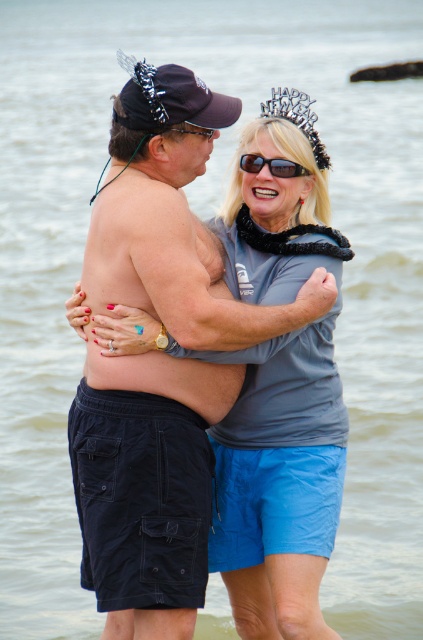
You are a photographer trying to capture a candid shot of the two people in the scene. You want to ensure both the sunglasses at center and the matte black goggles at center are clearly visible in the frame. Given their current distance apart, is there a risk that one might be out of focus if you focus on the other?

The sunglasses at center and matte black goggles at center are 4.96 feet apart. If you focus on one, the other may be slightly out of focus due to the distance, depending on your camera settings. Adjust your aperture for a deeper depth of field to ensure both are sharp.

You are a photographer trying to capture a clear shot of the sunglasses at center and the matte black goggles at center. Since both are at the same central position, which one is more likely to be fully visible in your photo?

The sunglasses at center is more likely to be fully visible because the matte black goggles at center is behind it.

What are the coordinates of the sunglasses at center?

The sunglasses at center are located at coordinates point (x=271, y=164).